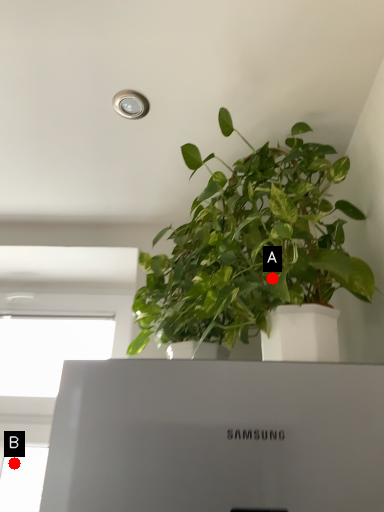
Question: Two points are circled on the image, labeled by A and B beside each circle. Which point is closer to the camera taking this photo?

Choices:
 (A) A is closer
 (B) B is closer

Answer: (A)